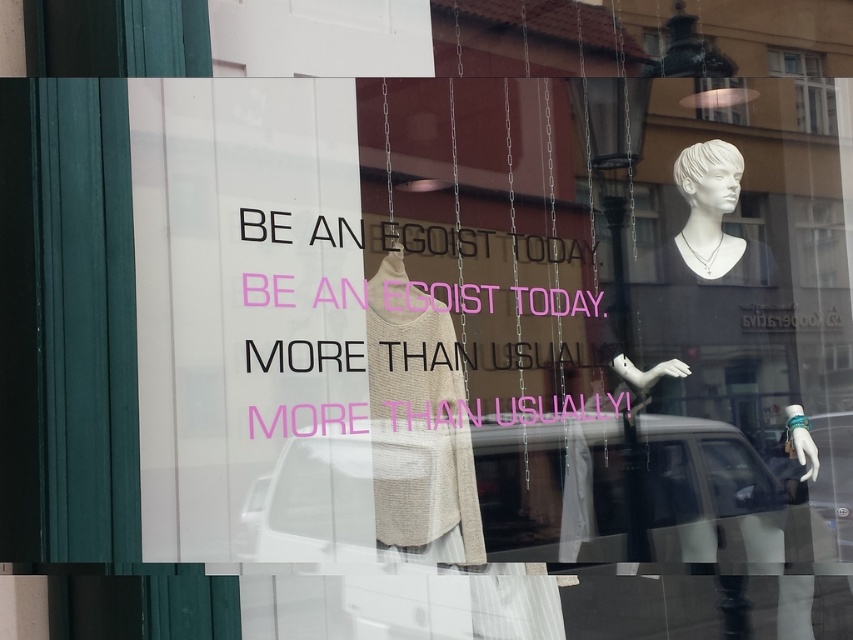
Is the position of transparent glass at upper center less distant than that of matte black hat at upper center?

No, transparent glass at upper center is behind matte black hat at upper center.

The height and width of the screenshot is (640, 853). What do you see at coordinates (805, 88) in the screenshot?
I see `transparent glass at upper center` at bounding box center [805, 88].

Does point (808, 115) come closer to viewer compared to point (730, 112)?

No, it is not.

Where is `transparent glass at upper center`? Image resolution: width=853 pixels, height=640 pixels. transparent glass at upper center is located at coordinates (805, 88).

Is point (422, 468) closer to camera compared to point (808, 108)?

Yes, it is.

Between beige knitted sweater at center and transparent glass at upper center, which one has less height?

Standing shorter between the two is transparent glass at upper center.

Does point (390, 288) come closer to viewer compared to point (775, 64)?

That is True.

Locate an element on the screen. The image size is (853, 640). beige knitted sweater at center is located at coordinates (418, 424).

Is beige knitted sweater at center smaller than matte black hat at upper center?

Incorrect, beige knitted sweater at center is not smaller in size than matte black hat at upper center.

Between beige knitted sweater at center and matte black hat at upper center, which one has more height?

With more height is beige knitted sweater at center.

Does point (480, 561) come farther from viewer compared to point (701, 116)?

No, (480, 561) is in front of (701, 116).

What are the coordinates of `beige knitted sweater at center` in the screenshot? It's located at (418, 424).